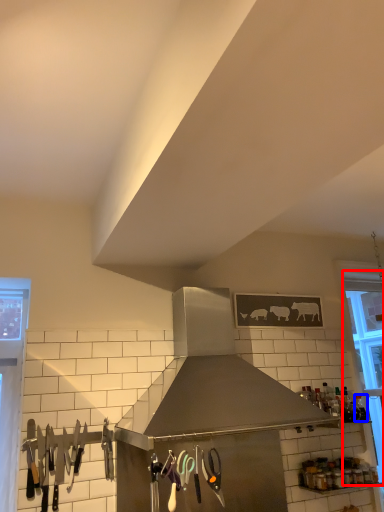
Question: Which of the following is the closest to the observer, window (highlighted by a red box) or bottle (highlighted by a blue box)?

Choices:
 (A) window
 (B) bottle

Answer: (B)